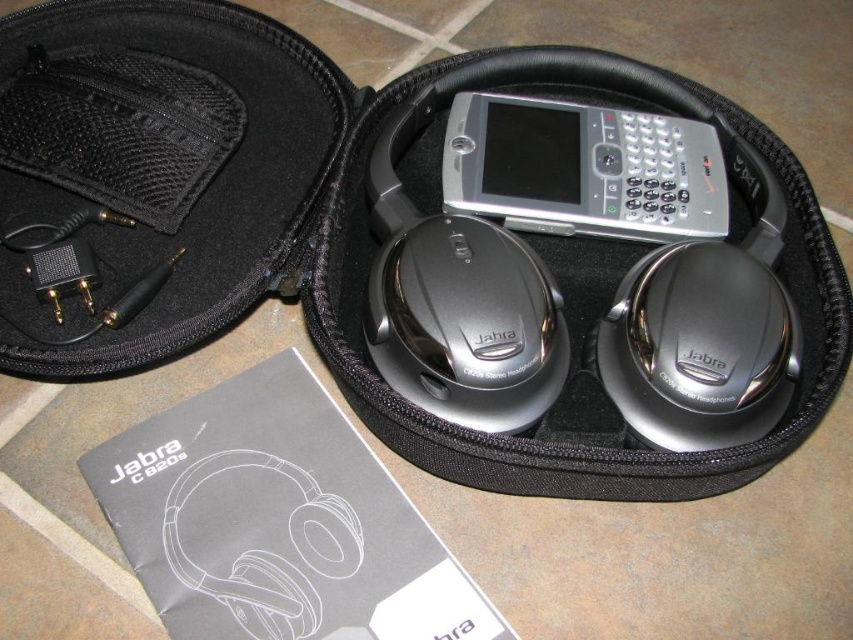
You are a customer at an electronics store and want to know if the silver metallic smartphone at center is placed on top of the satin silver headphones at center inside the Jabra C920s case. Can you confirm this?

Yes, the silver metallic smartphone at center is positioned over the satin silver headphones at center according to the description.

You are looking at the Jabra C920s stereo headset case and need to determine the position of two points inside it. The points are labeled as point 1 at coordinates point (x=462, y=97) and point 2 at coordinates point (x=485, y=227). Which point is closer to you when you are facing the case?

Point 1 at coordinates point (x=462, y=97) is closer to you because it is further to the viewer than point 2 at coordinates point (x=485, y=227).

You need to place both the silver metallic smartphone at center and the satin silver headphones at center into a new protective case that can only accommodate one of them. Based on their sizes, which one would fit better?

The silver metallic smartphone at center has a smaller size compared to the satin silver headphones at center, so it would fit better in the protective case designed for one item.